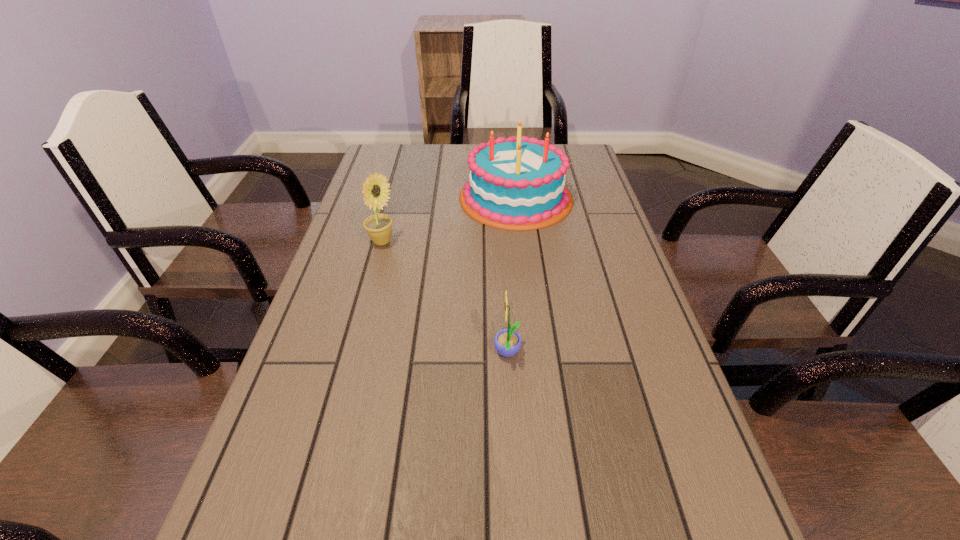
At what (x,y) coordinates should I click in order to perform the action: click on object positioned at the far edge. Please return your answer as a coordinate pair (x, y). Image resolution: width=960 pixels, height=540 pixels. Looking at the image, I should click on (518, 184).

Where is `object situated at the left edge`? The image size is (960, 540). object situated at the left edge is located at coordinates (378, 226).

Where is `object positioned at the right edge`? object positioned at the right edge is located at coordinates (518, 184).

Locate an element on the screen. The image size is (960, 540). object that is at the far right corner is located at coordinates (518, 184).

In the image, there is a desktop. Where is `vacant space at the left edge`? The image size is (960, 540). vacant space at the left edge is located at coordinates (364, 268).

At what (x,y) coordinates should I click in order to perform the action: click on free space at the right edge of the desktop. Please return your answer as a coordinate pair (x, y). This screenshot has height=540, width=960. Looking at the image, I should click on (578, 205).

The width and height of the screenshot is (960, 540). Find the location of `vacant point located between the nearer sunflower and the farthest object`. vacant point located between the nearer sunflower and the farthest object is located at coordinates (512, 275).

This screenshot has width=960, height=540. I want to click on free space between the farthest object and the shorter sunflower, so coord(512,275).

At what (x,y) coordinates should I click in order to perform the action: click on free spot between the shorter sunflower and the birthday cake. Please return your answer as a coordinate pair (x, y). The image size is (960, 540). Looking at the image, I should click on click(x=512, y=275).

In order to click on unoccupied position between the farther sunflower and the birthday cake in this screenshot , I will do `click(449, 220)`.